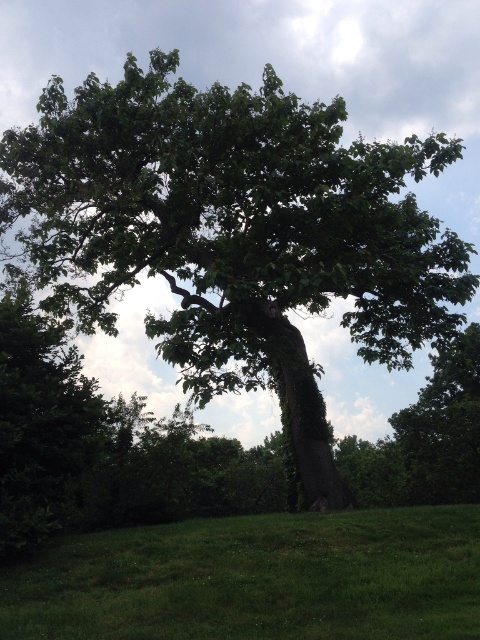
In the scene shown: Which is more to the right, green leafy oak tree at center or green grass at lower center?

Positioned to the right is green leafy oak tree at center.

Can you confirm if green leafy oak tree at center is bigger than green grass at lower center?

Indeed, green leafy oak tree at center has a larger size compared to green grass at lower center.

Find the location of a particular element. The height and width of the screenshot is (640, 480). green leafy oak tree at center is located at coordinates (237, 234).